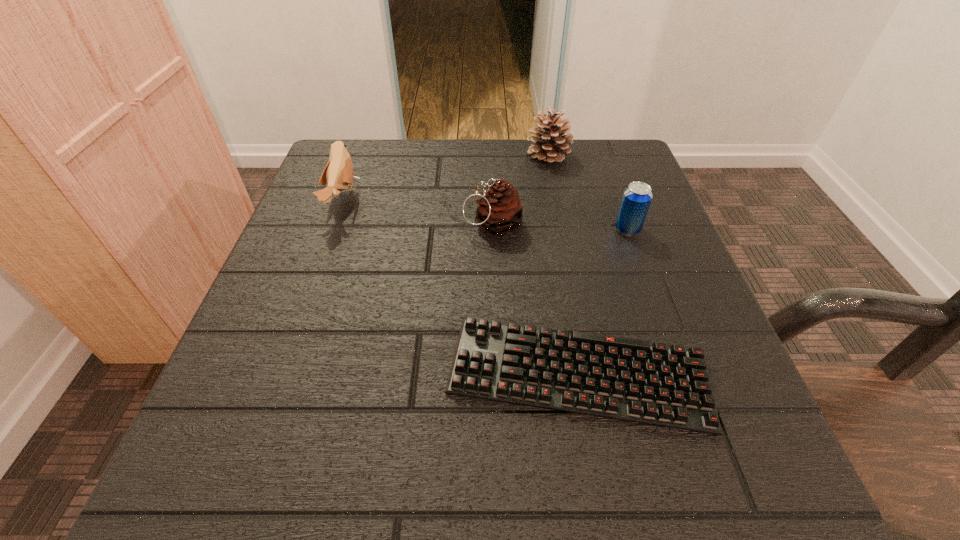
Where is `vacant space situated 0.150m with a leaf charm attached to the nearer pinecone`? This screenshot has height=540, width=960. vacant space situated 0.150m with a leaf charm attached to the nearer pinecone is located at coordinates [x=385, y=225].

Identify the location of blank space located at the beak of the leftmost object. (493, 200).

The width and height of the screenshot is (960, 540). I want to click on vacant space located 0.250m on the front of the beer can, so click(671, 350).

Locate an element on the screen. vacant space located on the back of the computer keyboard is located at coordinates (559, 264).

This screenshot has height=540, width=960. What are the coordinates of `pinecone present at the far edge` in the screenshot? It's located at (550, 146).

At what (x,y) coordinates should I click in order to perform the action: click on bird that is at the far edge. Please return your answer as a coordinate pair (x, y). This screenshot has width=960, height=540. Looking at the image, I should click on 338,174.

Locate an element on the screen. This screenshot has height=540, width=960. object located in the near edge section of the desktop is located at coordinates (627, 379).

The width and height of the screenshot is (960, 540). In order to click on object situated at the left edge in this screenshot , I will do `click(338, 174)`.

This screenshot has height=540, width=960. I want to click on pinecone located in the right edge section of the desktop, so click(x=550, y=146).

This screenshot has width=960, height=540. Find the location of `beer can located at the right edge`. beer can located at the right edge is located at coordinates (636, 199).